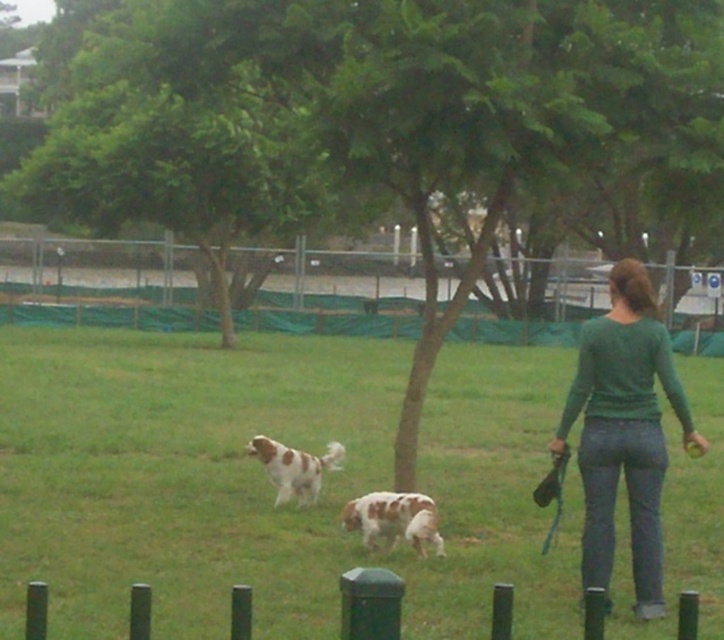
Who is positioned more to the right, green grass at center or green matte shirt at center?

green matte shirt at center

Is green grass at center bigger than green matte shirt at center?

Yes.

This screenshot has height=640, width=724. Identify the location of green grass at center. (269, 483).

You are a GUI agent. You are given a task and a screenshot of the screen. Output one action in this format:
    pyautogui.click(x=<x>, y=<y>)
    Task: Click on the green grass at center
    The height and width of the screenshot is (640, 724).
    Given the screenshot: What is the action you would take?
    pyautogui.click(x=269, y=483)

In order to click on spotted fur dog at center in this screenshot , I will do `click(395, 518)`.

Can you confirm if spotted fur dog at center is smaller than white speckled fur dog at center?

Yes.

This screenshot has height=640, width=724. I want to click on spotted fur dog at center, so click(x=395, y=518).

The height and width of the screenshot is (640, 724). I want to click on spotted fur dog at center, so tap(395, 518).

From the picture: Which is more to the right, green matte shirt at center or spotted fur dog at center?

green matte shirt at center is more to the right.

Is green matte shirt at center positioned at the back of spotted fur dog at center?

No, it is in front of spotted fur dog at center.

Based on the photo, who is more forward, (x=568, y=419) or (x=350, y=513)?

Positioned in front is point (x=568, y=419).

Identify the location of green matte shirt at center. The width and height of the screenshot is (724, 640). (623, 432).